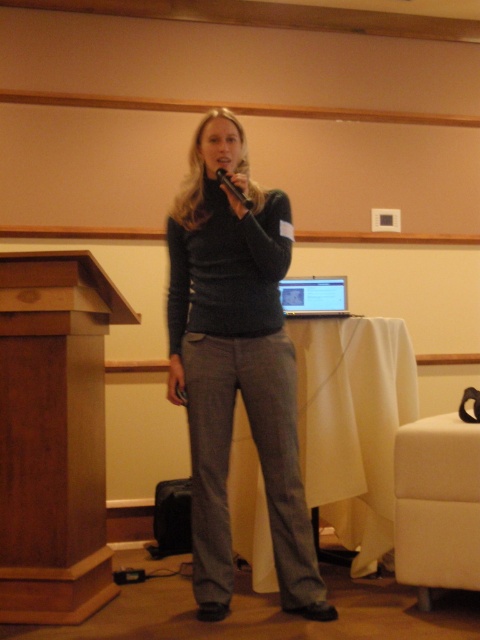
Can you confirm if silver metallic laptop at center is positioned above black matte microphone at center?

Actually, silver metallic laptop at center is below black matte microphone at center.

Does point (294, 276) lie behind point (223, 170)?

Yes, it is.

Find the location of a particular element. Image resolution: width=480 pixels, height=640 pixels. silver metallic laptop at center is located at coordinates (313, 296).

Does dark gray sweater at center have a larger size compared to white fabric armchair at lower right?

Correct, dark gray sweater at center is larger in size than white fabric armchair at lower right.

Can you confirm if dark gray sweater at center is positioned to the right of white fabric armchair at lower right?

Incorrect, dark gray sweater at center is not on the right side of white fabric armchair at lower right.

This screenshot has height=640, width=480. What do you see at coordinates (237, 365) in the screenshot? I see `dark gray sweater at center` at bounding box center [237, 365].

At what (x,y) coordinates should I click in order to perform the action: click on dark gray sweater at center. Please return your answer as a coordinate pair (x, y). Looking at the image, I should click on (237, 365).

Between point (1, 620) and point (219, 177), which one is positioned behind?

Positioned behind is point (1, 620).

Between point (97, 346) and point (218, 173), which one is positioned in front?

Point (218, 173) is in front.

At what (x,y) coordinates should I click in order to perform the action: click on wooden podium at left. Please return your answer as a coordinate pair (x, y). Looking at the image, I should click on (54, 435).

I want to click on wooden podium at left, so click(54, 435).